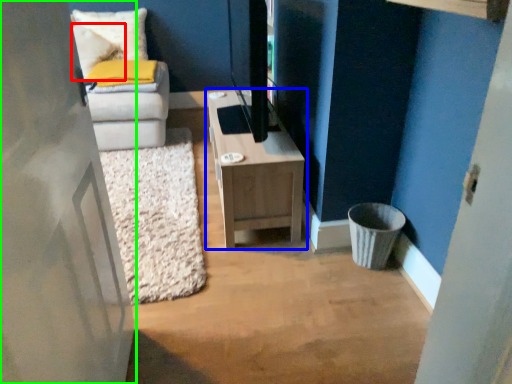
Question: Estimate the real-world distances between objects in this image. Which object is closer to pillow (highlighted by a red box), table (highlighted by a blue box) or door (highlighted by a green box)?

Choices:
 (A) table
 (B) door

Answer: (A)